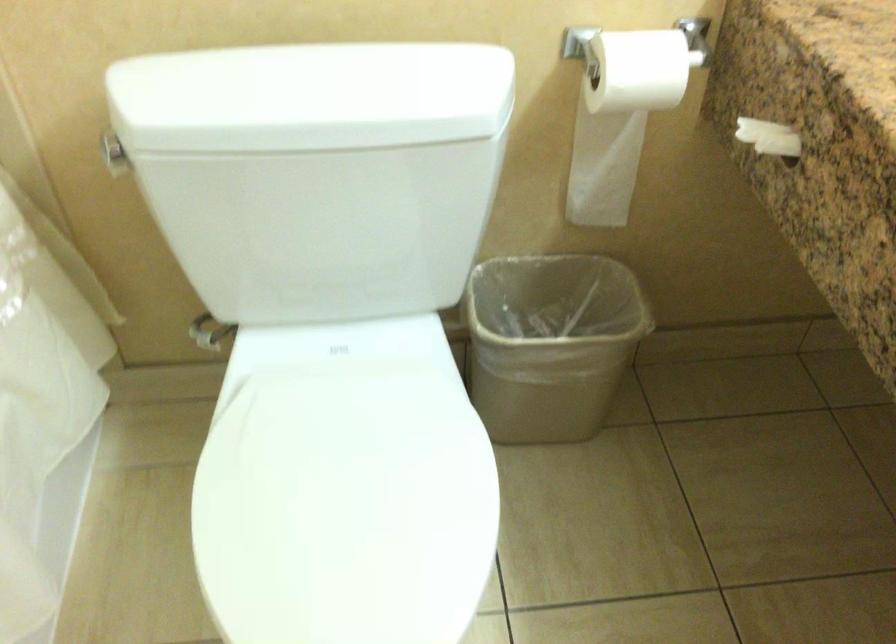
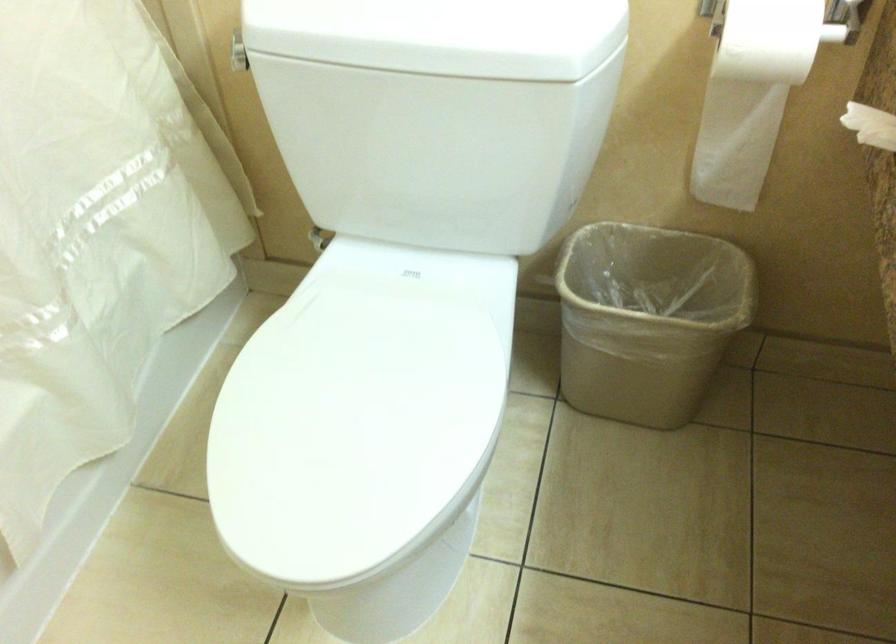
The point at (569, 344) is marked in the first image. Where is the corresponding point in the second image?

(647, 319)